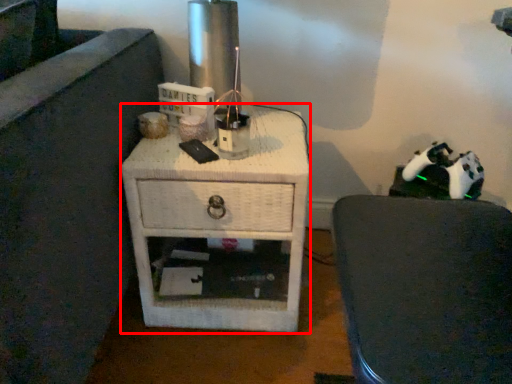
Question: Observing the image, what is the correct spatial positioning of nightstand (annotated by the red box) in reference to furniture?

Choices:
 (A) left
 (B) right

Answer: (A)